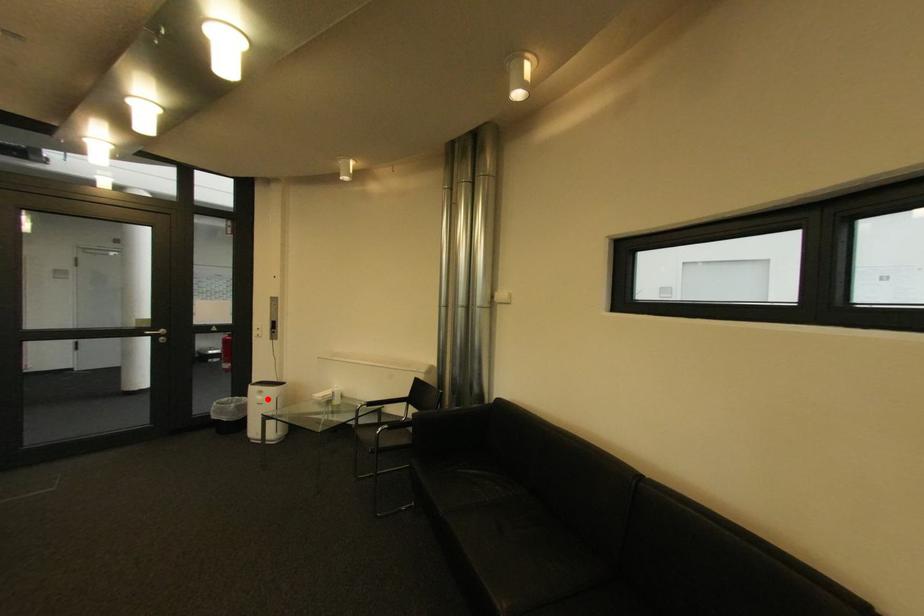
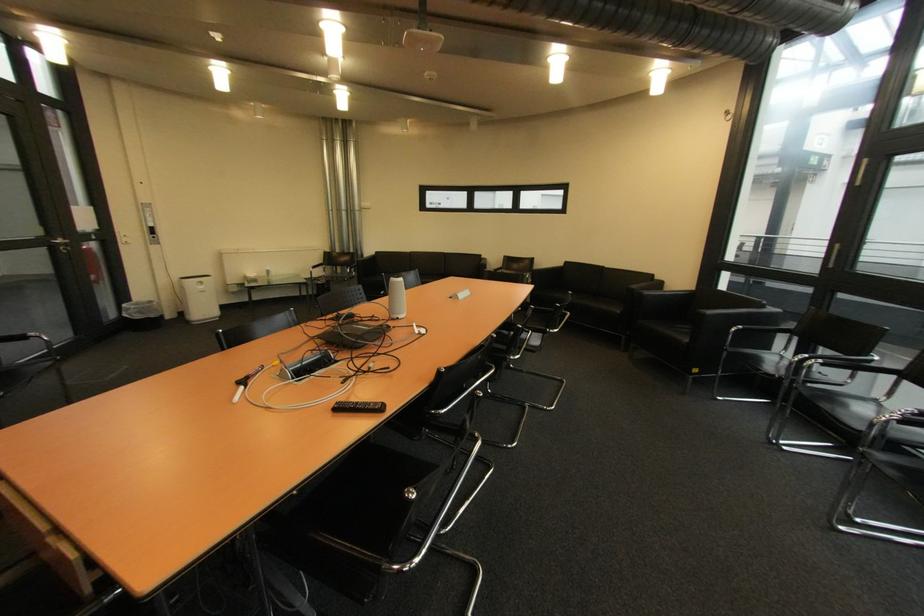
Question: I am providing you with two images of the same scene from different viewpoints. Given a red point in image1, look at the same physical point in image2. Is it:

Choices:
 (A) Closer to the viewpoint
 (B) Farther from the viewpoint

Answer: (A)